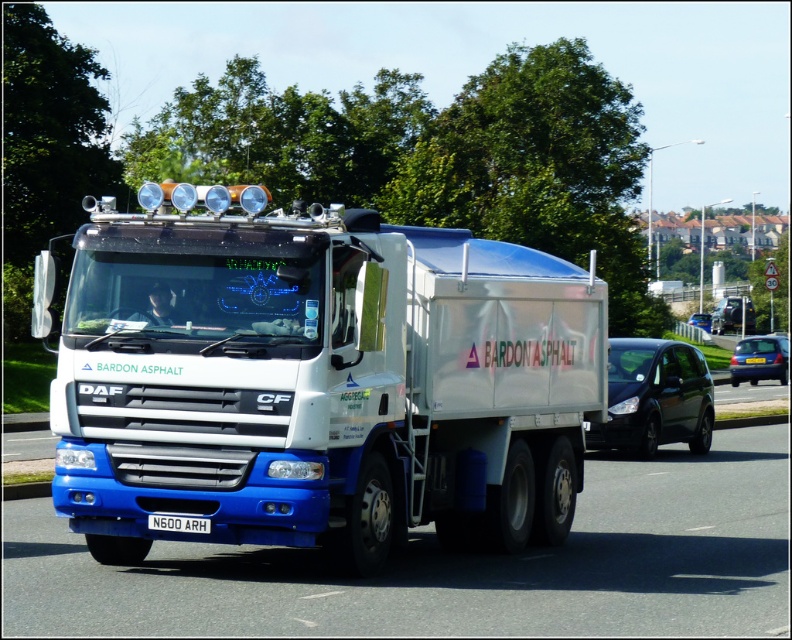
Question: Estimate the real-world distances between objects in this image. Which object is closer to the blue metallic hatchback at right?

Choices:
 (A) blue metallic van at center
 (B) black matte van at right
 (C) white metallic license plate at center

Answer: (B)

Question: Does white glossy truck at center appear on the right side of white metallic license plate at center?

Choices:
 (A) yes
 (B) no

Answer: (A)

Question: Is black matte van at right below blue metallic hatchback at right?

Choices:
 (A) yes
 (B) no

Answer: (A)

Question: Does blue metallic hatchback at right come in front of white metallic license plate at center?

Choices:
 (A) yes
 (B) no

Answer: (B)

Question: Which of the following is the closest to the observer?

Choices:
 (A) (615, 419)
 (B) (744, 358)

Answer: (A)

Question: Which object appears farthest from the camera in this image?

Choices:
 (A) blue metallic hatchback at right
 (B) black matte van at right
 (C) white matte truck at center

Answer: (C)